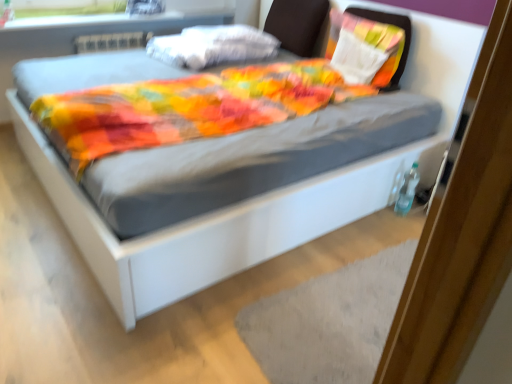
Locate an element on the screen. The width and height of the screenshot is (512, 384). free spot below gray textured mat at lower center (from a real-world perspective) is located at coordinates (347, 314).